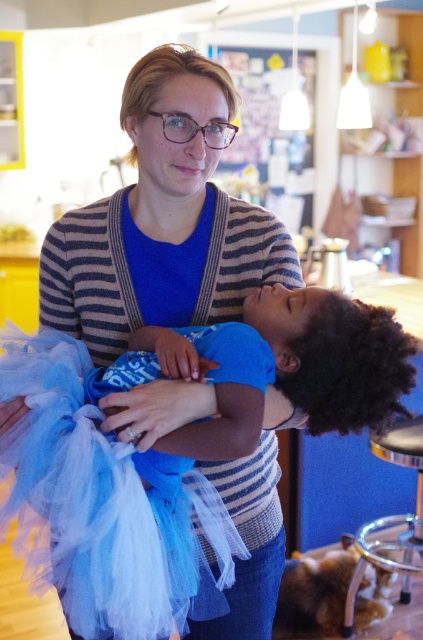
In the scene, there is a striped sweater at center and a blue tulle dress at center. Which object is taller?

The striped sweater at center is much taller than the blue tulle dress at center.

You are a photographer setting up for a family portrait. You notice the striped sweater at center and the metallic silver stool at lower right. Where should you position the lighting to ensure both objects are well illuminated?

The striped sweater at center is above the metallic silver stool at lower right, so positioning the light source above both objects will ensure both are well illuminated.

You are organizing a clothing donation drive and need to determine which item takes up more space in the donation box. Based on the image, which item is larger in size between the striped sweater at center and the blue tulle dress at center?

The striped sweater at center has a larger size compared to the blue tulle dress at center, so the striped sweater at center takes up more space in the donation box.